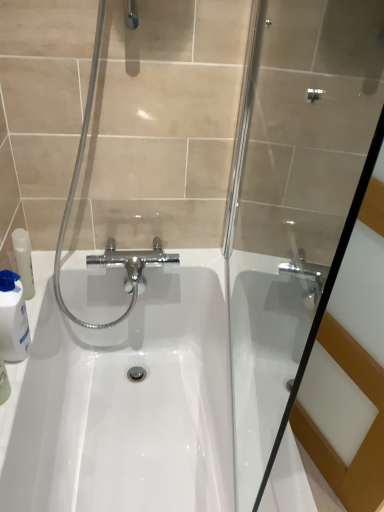
Question: Considering the positions of transparent glass shower door at center and white glossy bottle at left in the image, is transparent glass shower door at center taller or shorter than white glossy bottle at left?

Choices:
 (A) tall
 (B) short

Answer: (A)

Question: Is transparent glass shower door at center in front of or behind white glossy bottle at left in the image?

Choices:
 (A) front
 (B) behind

Answer: (A)

Question: Considering the real-world distances, which object is farthest from the transparent glass shower door at center?

Choices:
 (A) white glossy sink at center
 (B) white glossy bottle at left

Answer: (B)

Question: Considering the real-world distances, which object is closest to the transparent glass shower door at center?

Choices:
 (A) white glossy bottle at left
 (B) white glossy sink at center

Answer: (B)